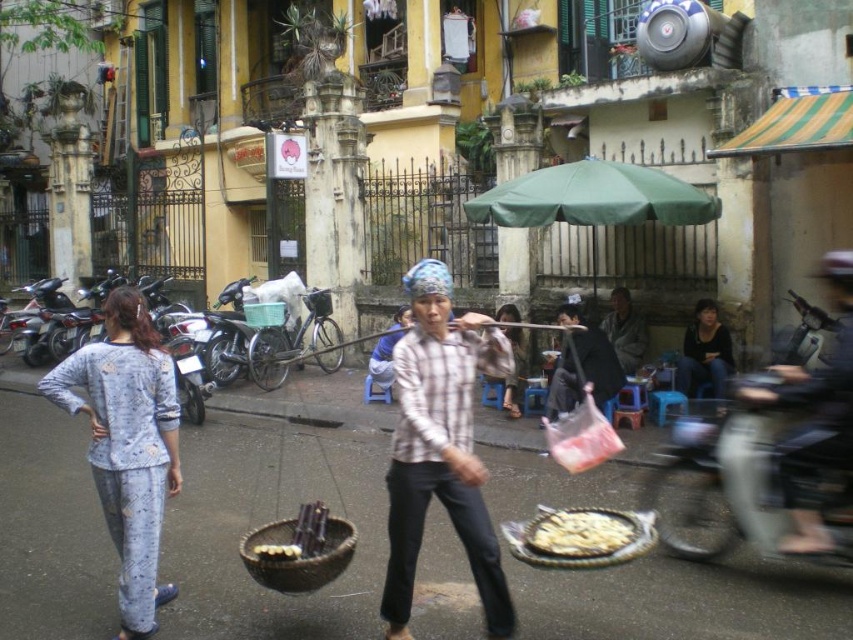
Question: Does plaid cotton shirt at center have a larger size compared to gray woolen sweater at center?

Choices:
 (A) yes
 (B) no

Answer: (A)

Question: Which point is closer to the camera taking this photo?

Choices:
 (A) (491, 218)
 (B) (549, 515)

Answer: (B)

Question: Which point appears farthest from the camera in this image?

Choices:
 (A) (572, 536)
 (B) (769, 380)
 (C) (515, 356)
 (D) (329, 536)

Answer: (C)

Question: From the image, what is the correct spatial relationship of light blue cotton pajamas at center in relation to green fabric umbrella at center?

Choices:
 (A) left
 (B) right

Answer: (A)

Question: Which point is closer to the camera?

Choices:
 (A) (619, 285)
 (B) (251, 308)
 (C) (166, 426)
 (D) (733, 362)

Answer: (C)

Question: Where is green fabric umbrella at center located in relation to smooth bamboo basket at center in the image?

Choices:
 (A) above
 (B) below

Answer: (A)